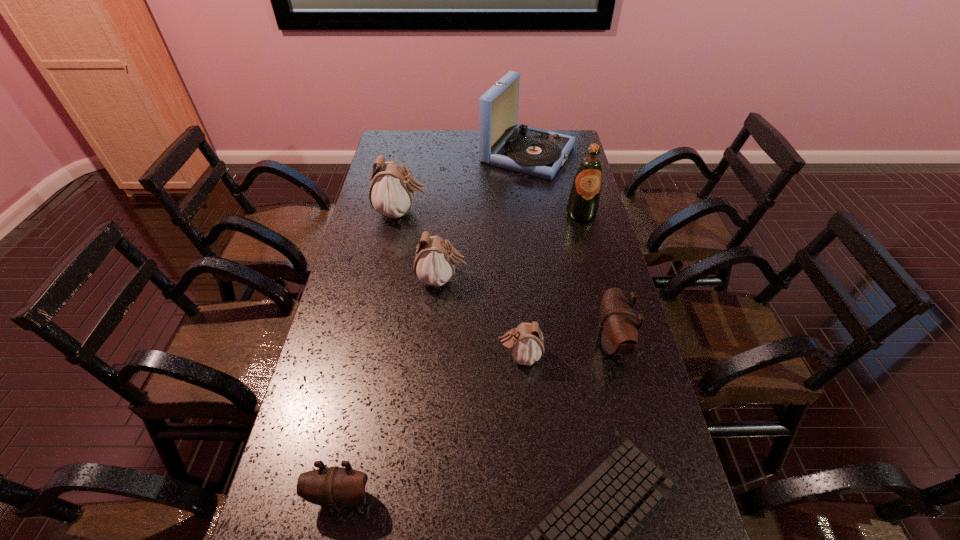
The height and width of the screenshot is (540, 960). In order to click on blank region between the tallest pouch and the olive oil in this screenshot , I will do `click(492, 213)`.

Image resolution: width=960 pixels, height=540 pixels. What are the coordinates of `object that stands as the closest to the farther brown pouch` in the screenshot? It's located at pyautogui.click(x=525, y=343).

Locate which object is the sixth closest to the green olive oil. Please provide its 2D coordinates. Your answer should be formatted as a tuple, i.e. [(x, y)], where the tuple contains the x and y coordinates of a point satisfying the conditions above.

[(585, 539)]

Choose which pouch is the second nearest neighbor to the rightmost white pouch. Please provide its 2D coordinates. Your answer should be formatted as a tuple, i.e. [(x, y)], where the tuple contains the x and y coordinates of a point satisfying the conditions above.

[(434, 264)]

Identify which pouch is located as the fourth nearest to the right brown pouch. Please provide its 2D coordinates. Your answer should be formatted as a tuple, i.e. [(x, y)], where the tuple contains the x and y coordinates of a point satisfying the conditions above.

[(391, 193)]

Locate which white pouch ranks second in proximity to the second smallest white pouch. Please provide its 2D coordinates. Your answer should be formatted as a tuple, i.e. [(x, y)], where the tuple contains the x and y coordinates of a point satisfying the conditions above.

[(525, 343)]

The image size is (960, 540). What are the coordinates of `white pouch that is the closest to the bigger brown pouch` in the screenshot? It's located at (525, 343).

Identify the location of free space in the image that satisfies the following two spatial constraints: 1. on the front-facing side of the farthest white pouch; 2. with the flap open on the left brown pouch. (345, 497).

Locate an element on the screen. This screenshot has width=960, height=540. vacant space that satisfies the following two spatial constraints: 1. on the front side of the blue phonograph record; 2. on the front-facing side of the farthest pouch is located at coordinates (536, 213).

The height and width of the screenshot is (540, 960). Find the location of `vacant space that satisfies the following two spatial constraints: 1. on the front-facing side of the olive oil; 2. with the flap open on the rightmost pouch`. vacant space that satisfies the following two spatial constraints: 1. on the front-facing side of the olive oil; 2. with the flap open on the rightmost pouch is located at coordinates (614, 342).